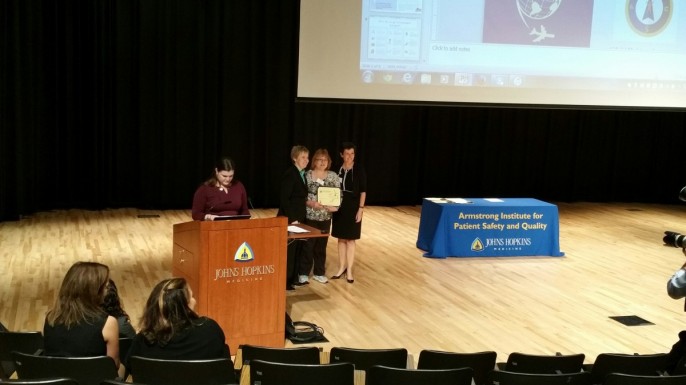
At what (x,y) coordinates should I click in order to perform the action: click on air vent. Please return your answer as a coordinate pair (x, y). This screenshot has height=385, width=686. Looking at the image, I should click on 628,319.